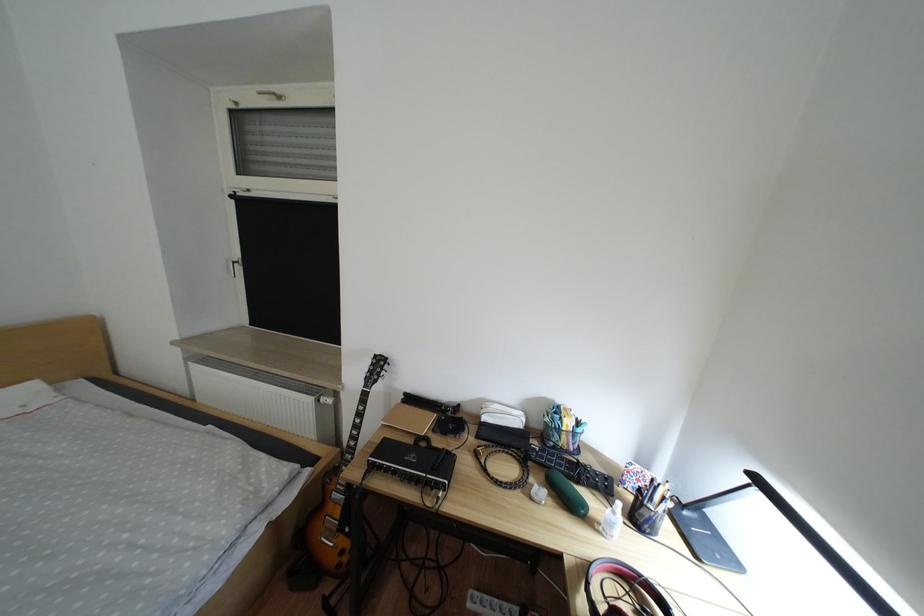
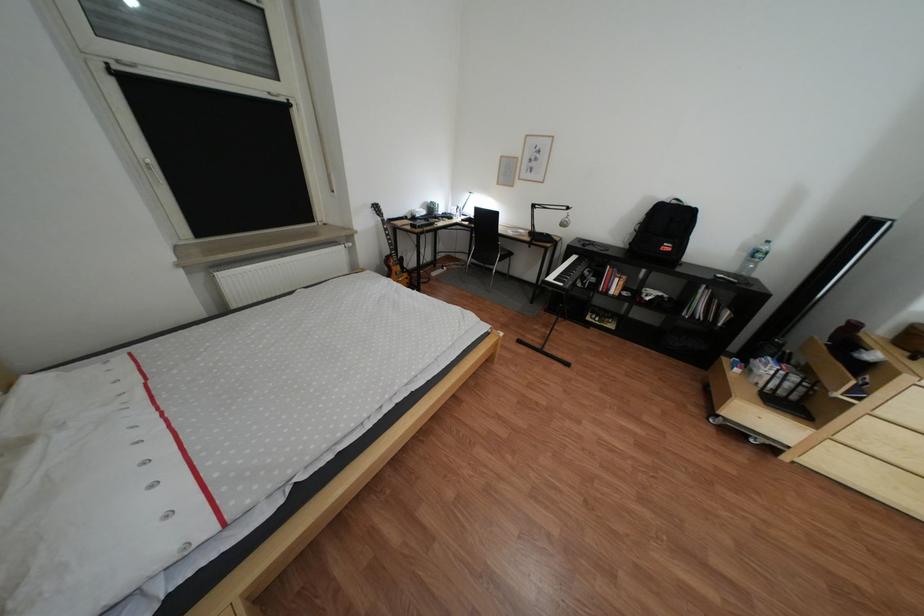
Question: I am providing you with two images of the same scene from different viewpoints. After the viewpoint changes to image2, which objects are now occluded?

Choices:
 (A) chair sitting surface
 (B) dark mobile phone
 (C) pen in holder
 (D) book on shelf

Answer: (C)